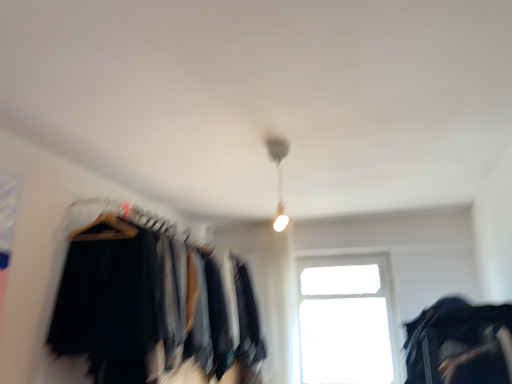
Question: Is black fabric clothes at left not inside white glossy lamp at upper center?

Choices:
 (A) no
 (B) yes

Answer: (B)

Question: Can you confirm if black fabric clothes at left is shorter than white glossy lamp at upper center?

Choices:
 (A) yes
 (B) no

Answer: (B)

Question: Is black fabric clothes at left wider than white glossy lamp at upper center?

Choices:
 (A) yes
 (B) no

Answer: (A)

Question: Is black fabric clothes at left positioned with its back to white glossy lamp at upper center?

Choices:
 (A) yes
 (B) no

Answer: (B)

Question: Would you say black fabric clothes at left contains white glossy lamp at upper center?

Choices:
 (A) yes
 (B) no

Answer: (B)

Question: Is black fabric clothes at left behind white glossy lamp at upper center?

Choices:
 (A) no
 (B) yes

Answer: (A)

Question: Could you tell me if transparent glass window at center is facing white glossy lamp at upper center?

Choices:
 (A) no
 (B) yes

Answer: (B)

Question: Is transparent glass window at center closer to the viewer compared to white glossy lamp at upper center?

Choices:
 (A) no
 (B) yes

Answer: (A)

Question: Can you confirm if transparent glass window at center is positioned to the left of white glossy lamp at upper center?

Choices:
 (A) yes
 (B) no

Answer: (B)

Question: Is transparent glass window at center turned away from white glossy lamp at upper center?

Choices:
 (A) no
 (B) yes

Answer: (A)

Question: From the image's perspective, would you say transparent glass window at center is shown under white glossy lamp at upper center?

Choices:
 (A) no
 (B) yes

Answer: (B)

Question: From a real-world perspective, is transparent glass window at center physically above white glossy lamp at upper center?

Choices:
 (A) no
 (B) yes

Answer: (A)

Question: From a real-world perspective, is black fabric bag at lower right positioned under white glossy lamp at upper center based on gravity?

Choices:
 (A) yes
 (B) no

Answer: (A)